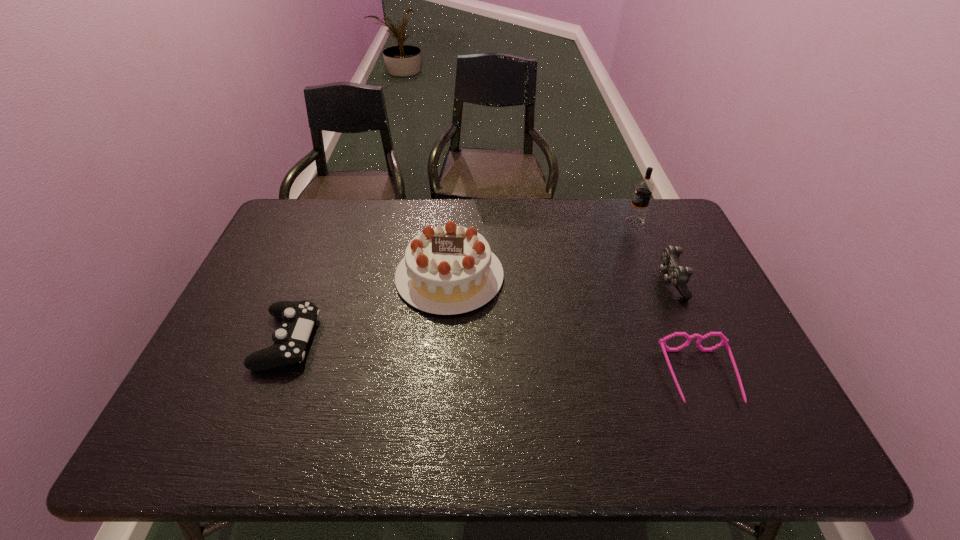
Where is `vodka that is at the right edge`? vodka that is at the right edge is located at coordinates (643, 190).

I want to click on control present at the right edge, so click(675, 273).

The height and width of the screenshot is (540, 960). Find the location of `spectacles that is positioned at the right edge`. spectacles that is positioned at the right edge is located at coordinates (724, 340).

This screenshot has width=960, height=540. Find the location of `object present at the far right corner`. object present at the far right corner is located at coordinates (643, 190).

I want to click on blank space at the far edge of the desktop, so click(x=439, y=211).

In the image, there is a desktop. Identify the location of vacant space at the near edge. Image resolution: width=960 pixels, height=540 pixels. (686, 432).

The width and height of the screenshot is (960, 540). Identify the location of free space at the left edge of the desktop. 311,254.

Where is `vacant space at the right edge of the desktop`? The width and height of the screenshot is (960, 540). vacant space at the right edge of the desktop is located at coordinates (656, 252).

Where is `vacant area at the near left corner of the desktop`? This screenshot has height=540, width=960. vacant area at the near left corner of the desktop is located at coordinates (180, 436).

This screenshot has height=540, width=960. I want to click on free area in between the third shortest object and the spectacles, so click(685, 329).